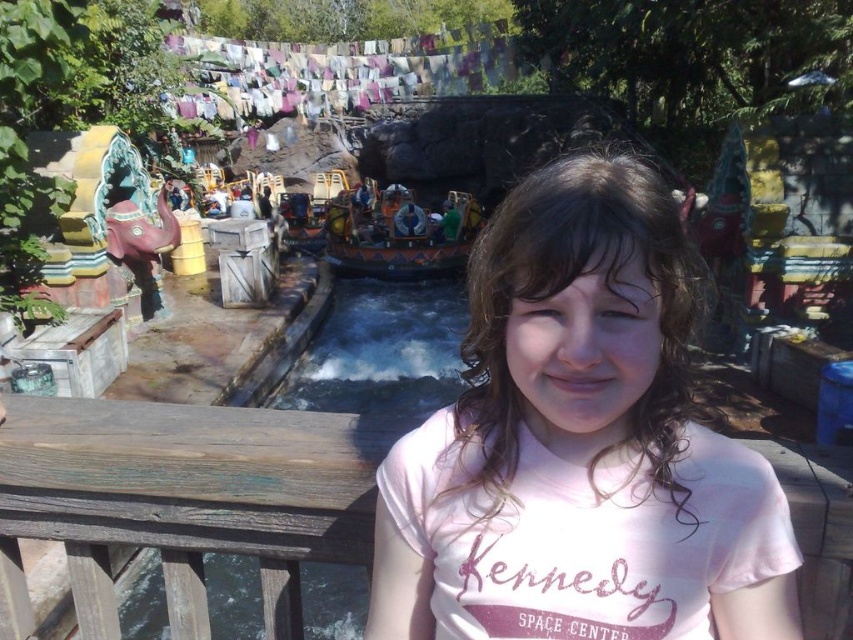
Does pink cotton shirt at center have a larger size compared to colorful fabric clothesline at upper center?

Actually, pink cotton shirt at center might be smaller than colorful fabric clothesline at upper center.

Can you confirm if pink cotton shirt at center is positioned to the right of colorful fabric clothesline at upper center?

Correct, you'll find pink cotton shirt at center to the right of colorful fabric clothesline at upper center.

In order to click on pink cotton shirt at center in this screenshot , I will do `click(579, 445)`.

Between pink cotton shirt at center and wooden painted boat at center, which one appears on the right side from the viewer's perspective?

pink cotton shirt at center is more to the right.

Who is positioned more to the left, pink cotton shirt at center or wooden painted boat at center?

Positioned to the left is wooden painted boat at center.

Which is behind, point (721, 436) or point (450, 227)?

Point (450, 227)

Where is `pink cotton shirt at center`? pink cotton shirt at center is located at coordinates (579, 445).

Which is above, colorful fabric clothesline at upper center or wooden painted boat at center?

colorful fabric clothesline at upper center is above.

Can you confirm if colorful fabric clothesline at upper center is bigger than wooden painted boat at center?

Indeed, colorful fabric clothesline at upper center has a larger size compared to wooden painted boat at center.

Where is `colorful fabric clothesline at upper center`? colorful fabric clothesline at upper center is located at coordinates (345, 72).